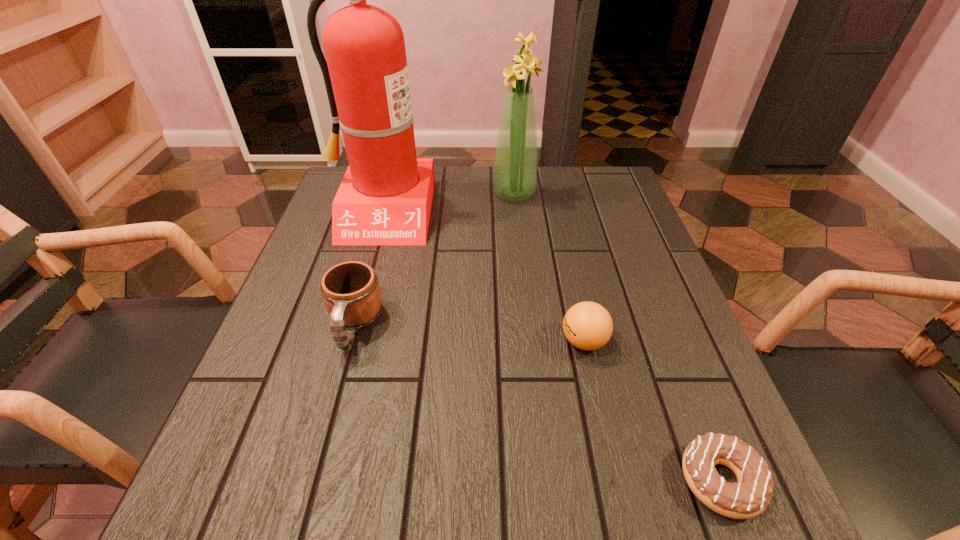
The image size is (960, 540). In order to click on object that is the second closest to the mug in this screenshot , I will do `click(587, 325)`.

The width and height of the screenshot is (960, 540). Find the location of `free space that satisfies the following two spatial constraints: 1. on the front-facing side of the fire extinguisher; 2. on the left side of the nearest object`. free space that satisfies the following two spatial constraints: 1. on the front-facing side of the fire extinguisher; 2. on the left side of the nearest object is located at coordinates (305, 481).

The height and width of the screenshot is (540, 960). In order to click on vacant point that satisfies the following two spatial constraints: 1. on the front-facing side of the bouquet; 2. on the front-facing side of the fire extinguisher in this screenshot , I will do click(x=516, y=211).

The width and height of the screenshot is (960, 540). I want to click on vacant region that satisfies the following two spatial constraints: 1. on the side with brand of the ping-pong ball; 2. on the back side of the nearest object, so click(x=614, y=481).

Locate an element on the screen. The image size is (960, 540). free space that satisfies the following two spatial constraints: 1. on the front-facing side of the nearest object; 2. on the left side of the fourth shortest object is located at coordinates (543, 481).

What are the coordinates of `blank space that satisfies the following two spatial constraints: 1. on the front-facing side of the bouquet; 2. on the front-facing side of the fire extinguisher` in the screenshot? It's located at (516, 211).

The width and height of the screenshot is (960, 540). Identify the location of free space that satisfies the following two spatial constraints: 1. on the side of the doughnut with the handle; 2. on the left side of the mug. coord(312,481).